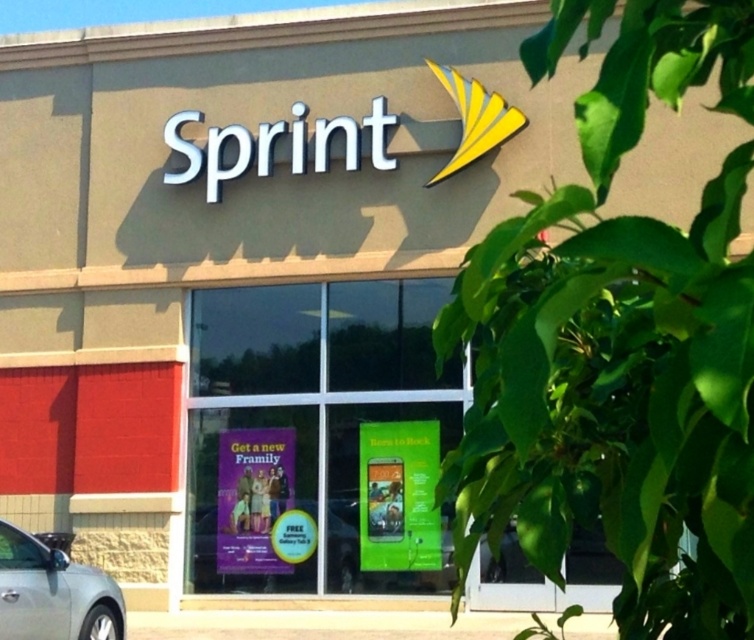
Between point (51, 564) and point (231, 480), which one is positioned behind?

The point (231, 480) is more distant.

Can you confirm if silver metallic car at lower left is positioned above purple glossy poster at lower center?

Correct, silver metallic car at lower left is located above purple glossy poster at lower center.

Between point (92, 572) and point (290, 504), which one is positioned behind?

Positioned behind is point (290, 504).

The width and height of the screenshot is (754, 640). I want to click on silver metallic car at lower left, so click(54, 593).

Is green matte phone at center taller than silver metallic car at lower left?

Yes.

Can you confirm if green matte phone at center is wider than silver metallic car at lower left?

Indeed, green matte phone at center has a greater width compared to silver metallic car at lower left.

What do you see at coordinates (397, 496) in the screenshot? I see `green matte phone at center` at bounding box center [397, 496].

At what (x,y) coordinates should I click in order to perform the action: click on green matte phone at center. Please return your answer as a coordinate pair (x, y). The height and width of the screenshot is (640, 754). Looking at the image, I should click on (397, 496).

Between green matte phone at center and purple glossy poster at lower center, which one has less height?

With less height is purple glossy poster at lower center.

Between green matte phone at center and purple glossy poster at lower center, which one is positioned higher?

Positioned higher is green matte phone at center.

Which is behind, point (365, 458) or point (231, 515)?

Point (231, 515)

At what (x,y) coordinates should I click in order to perform the action: click on green matte phone at center. Please return your answer as a coordinate pair (x, y). The height and width of the screenshot is (640, 754). Looking at the image, I should click on (397, 496).